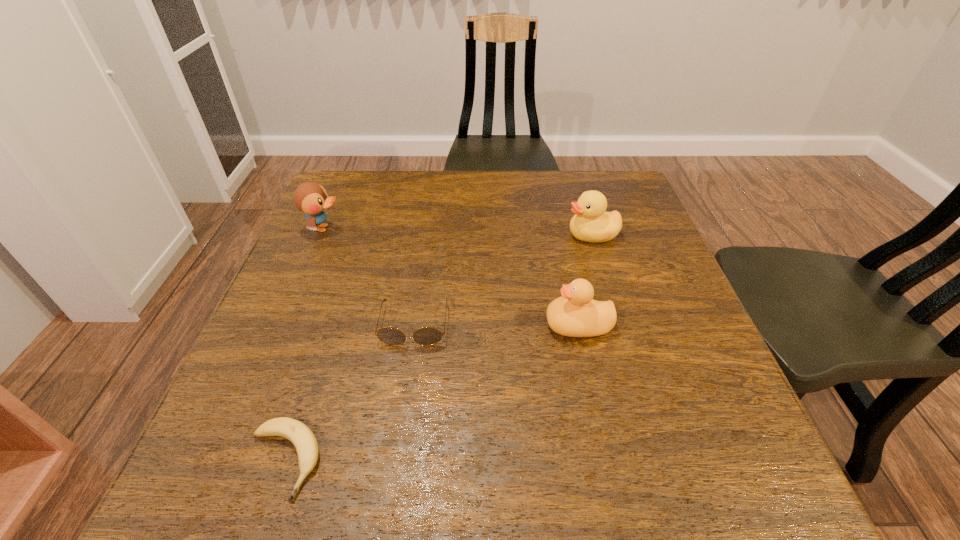
Image resolution: width=960 pixels, height=540 pixels. What are the coordinates of `object that is the second closest one to the second shortest object` in the screenshot? It's located at (575, 314).

This screenshot has height=540, width=960. In order to click on object that stands as the closest to the nearest object in this screenshot , I will do `click(426, 336)`.

Select which duck appears as the third closest to the second shortest object. Please provide its 2D coordinates. Your answer should be formatted as a tuple, i.e. [(x, y)], where the tuple contains the x and y coordinates of a point satisfying the conditions above.

[(591, 223)]

Select which duck appears as the second closest to the leftmost duck. Please provide its 2D coordinates. Your answer should be formatted as a tuple, i.e. [(x, y)], where the tuple contains the x and y coordinates of a point satisfying the conditions above.

[(591, 223)]

At what (x,y) coordinates should I click in order to perform the action: click on free location that satisfies the following two spatial constraints: 1. on the front-facing side of the shortest object; 2. on the left side of the leftmost duck. Please return your answer as a coordinate pair (x, y). Looking at the image, I should click on (224, 460).